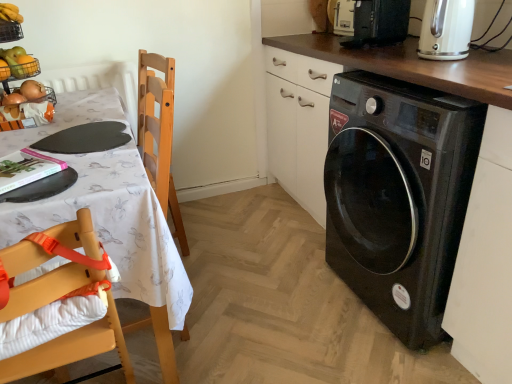
Looking at this image, what is the approximate height of black plastic microwave at upper right?

black plastic microwave at upper right is 19.74 centimeters in height.

The image size is (512, 384). What do you see at coordinates (20, 70) in the screenshot? I see `metallic wire basket at upper left` at bounding box center [20, 70].

What do you see at coordinates (55, 269) in the screenshot?
I see `wooden highchair at left` at bounding box center [55, 269].

This screenshot has width=512, height=384. I want to click on cream matte electric kettle at upper right, so (x=446, y=29).

This screenshot has width=512, height=384. What are the coordinates of `black plastic microwave at upper right` in the screenshot? It's located at (379, 23).

Is black plastic microwave at upper right with cream matte electric kettle at upper right?

No.

Does point (395, 30) lie in front of point (426, 44)?

No, (395, 30) is further to viewer.

How far apart are black plastic microwave at upper right and cream matte electric kettle at upper right?

black plastic microwave at upper right is 12.69 inches away from cream matte electric kettle at upper right.

In order to click on kitchen appliance below the black plastic microwave at upper right (from the image's perspective) in this screenshot , I will do `click(446, 29)`.

Image resolution: width=512 pixels, height=384 pixels. Identify the location of chair that is on the left side of black glossy washing machine at lower right. (55, 269).

Considering their positions, is wooden highchair at left located in front of or behind black glossy washing machine at lower right?

Clearly, wooden highchair at left is in front of black glossy washing machine at lower right.

Considering the points (49, 254) and (361, 237), which point is behind, point (49, 254) or point (361, 237)?

The point (361, 237) is farther from the camera.

Is wooden highchair at left inside or outside of black glossy washing machine at lower right?

wooden highchair at left exists outside the volume of black glossy washing machine at lower right.

How far apart are metallic wire basket at upper left and black glossy washing machine at lower right?

A distance of 1.38 meters exists between metallic wire basket at upper left and black glossy washing machine at lower right.

Find the location of a particular element. This screenshot has width=512, height=384. washing machine that is on the right side of metallic wire basket at upper left is located at coordinates click(399, 196).

Does metallic wire basket at upper left appear on the right side of black glossy washing machine at lower right?

Incorrect, metallic wire basket at upper left is not on the right side of black glossy washing machine at lower right.

Does metallic wire basket at upper left come behind black glossy washing machine at lower right?

Yes, metallic wire basket at upper left is behind black glossy washing machine at lower right.

How far apart are cream matte electric kettle at upper right and metallic wire basket at upper left?

cream matte electric kettle at upper right and metallic wire basket at upper left are 4.78 feet apart.

Is metallic wire basket at upper left at the back of cream matte electric kettle at upper right?

No, cream matte electric kettle at upper right is not facing the opposite direction of metallic wire basket at upper left.

Does cream matte electric kettle at upper right have a lesser height compared to metallic wire basket at upper left?

A: No, cream matte electric kettle at upper right is not shorter than metallic wire basket at upper left.

Looking at their sizes, would you say cream matte electric kettle at upper right is wider or thinner than metallic wire basket at upper left?

Considering their sizes, cream matte electric kettle at upper right looks slimmer than metallic wire basket at upper left.

Is cream matte electric kettle at upper right at the back of black glossy washing machine at lower right?

black glossy washing machine at lower right is not turned away from cream matte electric kettle at upper right.

Looking at this image, from a real-world perspective, is black glossy washing machine at lower right located beneath cream matte electric kettle at upper right?

Indeed, from a real-world perspective, black glossy washing machine at lower right is positioned beneath cream matte electric kettle at upper right.

Which of these two, black glossy washing machine at lower right or cream matte electric kettle at upper right, is smaller?

cream matte electric kettle at upper right.

Considering the sizes of objects black glossy washing machine at lower right and cream matte electric kettle at upper right in the image provided, who is shorter, black glossy washing machine at lower right or cream matte electric kettle at upper right?

Standing shorter between the two is cream matte electric kettle at upper right.

Find the location of a particular element. The height and width of the screenshot is (384, 512). basket that is behind the white fabric tablecloth at left is located at coordinates pyautogui.click(x=20, y=70).

In the image, is white fabric tablecloth at left on the left side or the right side of metallic wire basket at upper left?

In the image, white fabric tablecloth at left appears on the right side of metallic wire basket at upper left.

Is point (132, 245) in front of point (22, 76)?

Yes, it is.

Locate an element on the screen. chair lying below the white fabric tablecloth at left (from the image's perspective) is located at coordinates (55, 269).

Is white fabric tablecloth at left with wooden highchair at left?

No, white fabric tablecloth at left is not next to wooden highchair at left.

Which object is closer to the camera, white fabric tablecloth at left or wooden highchair at left?

wooden highchair at left.

Is white fabric tablecloth at left thinner than wooden highchair at left?

No.

Where is `kitchen appliance on the right of black plastic microwave at upper right`? The height and width of the screenshot is (384, 512). kitchen appliance on the right of black plastic microwave at upper right is located at coordinates (446, 29).

This screenshot has width=512, height=384. I want to click on washing machine located behind the wooden highchair at left, so click(399, 196).

Looking at the image, which one is located closer to white fabric tablecloth at left, black glossy washing machine at lower right or cream matte electric kettle at upper right?

black glossy washing machine at lower right lies closer to white fabric tablecloth at left than the other object.

Which object lies nearer to the anchor point black glossy washing machine at lower right, white fabric tablecloth at left or metallic wire basket at upper left?

Based on the image, white fabric tablecloth at left appears to be nearer to black glossy washing machine at lower right.

Looking at the image, which one is located further to wooden highchair at left, white fabric tablecloth at left or cream matte electric kettle at upper right?

Based on the image, cream matte electric kettle at upper right appears to be further to wooden highchair at left.

Considering their positions, is black plastic microwave at upper right positioned closer to cream matte electric kettle at upper right than black glossy washing machine at lower right?

Based on the image, black plastic microwave at upper right appears to be nearer to cream matte electric kettle at upper right.

From the picture: Based on their spatial positions, is metallic wire basket at upper left or wooden highchair at left further from cream matte electric kettle at upper right?

metallic wire basket at upper left.

Considering their positions, is white fabric tablecloth at left positioned closer to metallic wire basket at upper left than cream matte electric kettle at upper right?

white fabric tablecloth at left is closer to metallic wire basket at upper left.

Estimate the real-world distances between objects in this image. Which object is further from white fabric tablecloth at left, wooden highchair at left or cream matte electric kettle at upper right?

cream matte electric kettle at upper right.

From the image, which object appears to be farther from white fabric tablecloth at left, black plastic microwave at upper right or black glossy washing machine at lower right?

black plastic microwave at upper right is further to white fabric tablecloth at left.

The image size is (512, 384). I want to click on appliance between metallic wire basket at upper left and black glossy washing machine at lower right in the horizontal direction, so click(379, 23).

Identify the location of appliance between wooden highchair at left and cream matte electric kettle at upper right. (379, 23).

In order to click on appliance between metallic wire basket at upper left and cream matte electric kettle at upper right from left to right in this screenshot , I will do 379,23.

This screenshot has height=384, width=512. What are the coordinates of `chair between white fabric tablecloth at left and black glossy washing machine at lower right in the horizontal direction` in the screenshot? It's located at (55, 269).